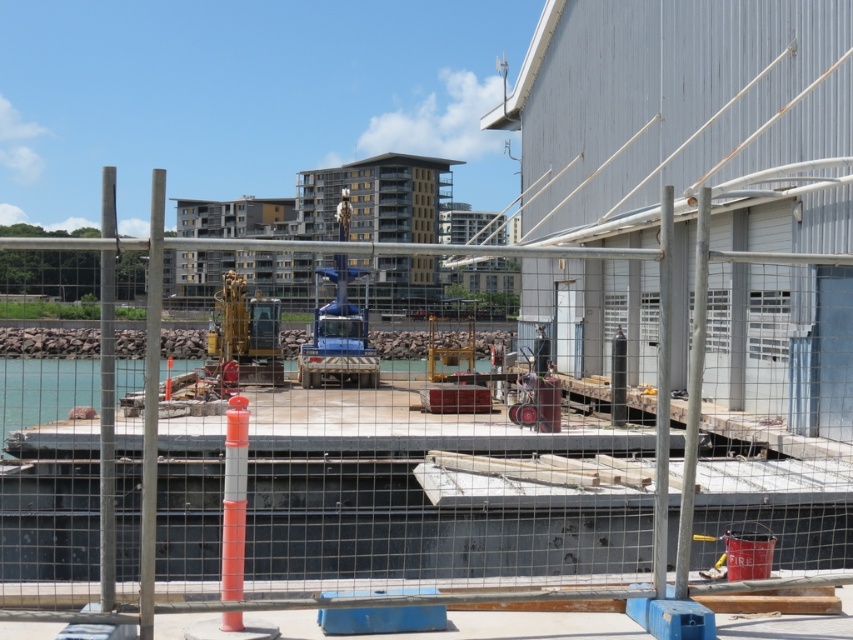
Is point (688, 358) closer to camera compared to point (343, 268)?

That is True.

Does point (660, 368) come behind point (300, 371)?

No, it is not.

Is point (476, 376) farther from camera compared to point (366, 342)?

No.

Where is `matte concrete platform at center`? The image size is (853, 640). matte concrete platform at center is located at coordinates (380, 464).

Is point (531, 253) less distant than point (242, 307)?

Yes, point (531, 253) is closer to viewer.

Between matte concrete platform at center and gold metallic excavator at center, which one appears on the right side from the viewer's perspective?

matte concrete platform at center

The width and height of the screenshot is (853, 640). Find the location of `matte concrete platform at center`. matte concrete platform at center is located at coordinates (380, 464).

What are the coordinates of `matte concrete platform at center` in the screenshot? It's located at (380, 464).

Can you confirm if blue metallic crane at center is positioned to the left of gold metallic excavator at center?

In fact, blue metallic crane at center is to the right of gold metallic excavator at center.

Is point (339, 256) closer to camera compared to point (233, 305)?

Yes, it is.

Identify the location of blue metallic crane at center. Image resolution: width=853 pixels, height=640 pixels. (338, 333).